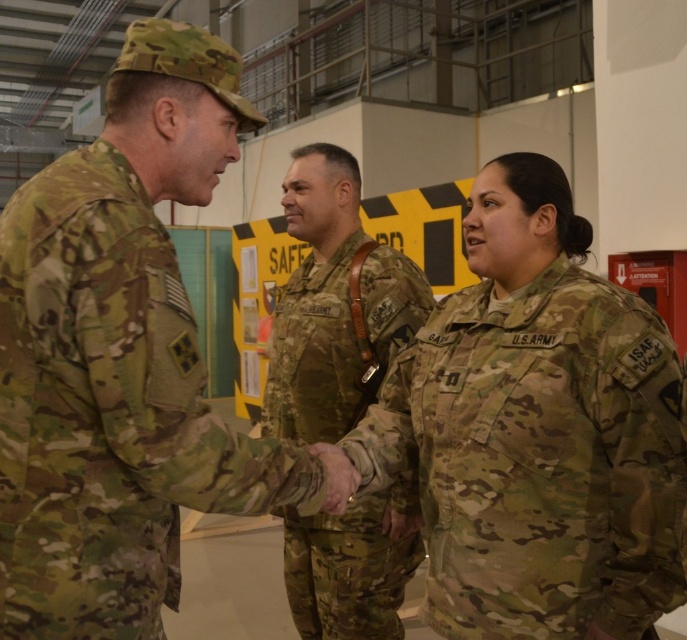
Which of these two, camouflage fabric uniform at left or camouflage fabric uniform at center, stands taller?

Standing taller between the two is camouflage fabric uniform at center.

This screenshot has height=640, width=687. I want to click on camouflage fabric uniform at left, so click(x=109, y=412).

Identify the location of camouflage fabric uniform at left. The image size is (687, 640). (109, 412).

Between camo fabric uniform at center and camouflage fabric uniform at center, which one has more height?

camouflage fabric uniform at center is taller.

Can you confirm if camo fabric uniform at center is smaller than camouflage fabric uniform at center?

Yes.

Which is in front, point (675, 518) or point (289, 342)?

Point (675, 518)

Locate an element on the screen. This screenshot has width=687, height=640. camo fabric uniform at center is located at coordinates click(x=539, y=458).

Who is lower down, camo fabric uniform at center or camouflage fabric uniform at left?

Positioned lower is camo fabric uniform at center.

Between camo fabric uniform at center and camouflage fabric uniform at left, which one is positioned higher?

camouflage fabric uniform at left is above.

Which is behind, point (627, 604) or point (181, 307)?

The point (627, 604) is more distant.

You are a GUI agent. You are given a task and a screenshot of the screen. Output one action in this format:
    pyautogui.click(x=<x>, y=<y>)
    Task: Click on the camo fabric uniform at center
    This screenshot has width=687, height=640.
    Given the screenshot: What is the action you would take?
    [x=539, y=458]